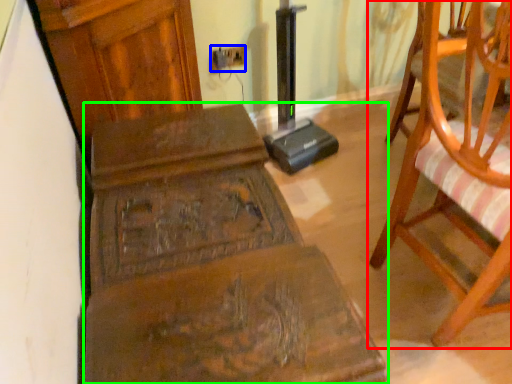
Question: Estimate the real-world distances between objects in this image. Which object is farther from chair (highlighted by a red box), electric outlet (highlighted by a blue box) or furniture (highlighted by a green box)?

Choices:
 (A) electric outlet
 (B) furniture

Answer: (A)